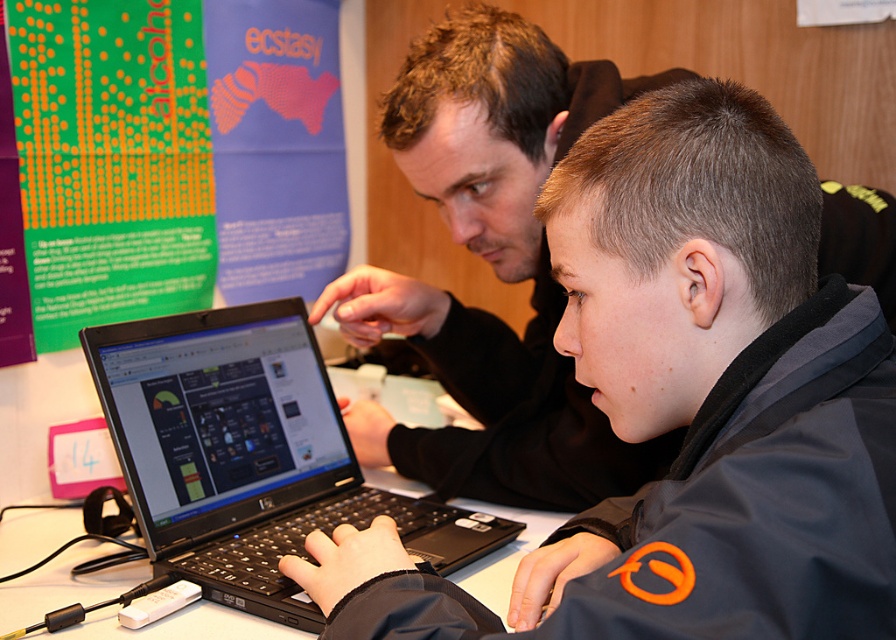
You are the person on the right in the image. You want to place your hand on the green paper at upper left. Can you reach it without moving your body?

The green paper at upper left is located at coordinates (174,154), so you can reach it without moving your body.

You are a delivery person who needs to place two laptops on a shelf. The shelf has a height limit of 10 cm. You have the black matte laptop at left and the black plastic laptop at center. Which laptop can you safely place on the shelf without exceeding the height limit?

The black plastic laptop at center can be safely placed on the shelf without exceeding the height limit because it is shorter than the black matte laptop at left, which is taller than the 10 cm limit.